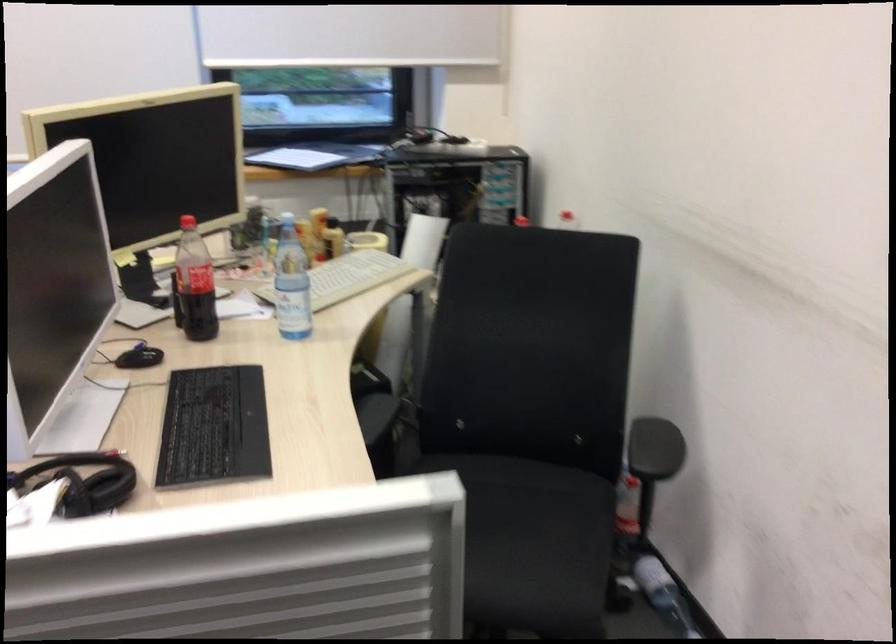
In order to click on chair sitting surface in this screenshot , I will do `click(550, 529)`.